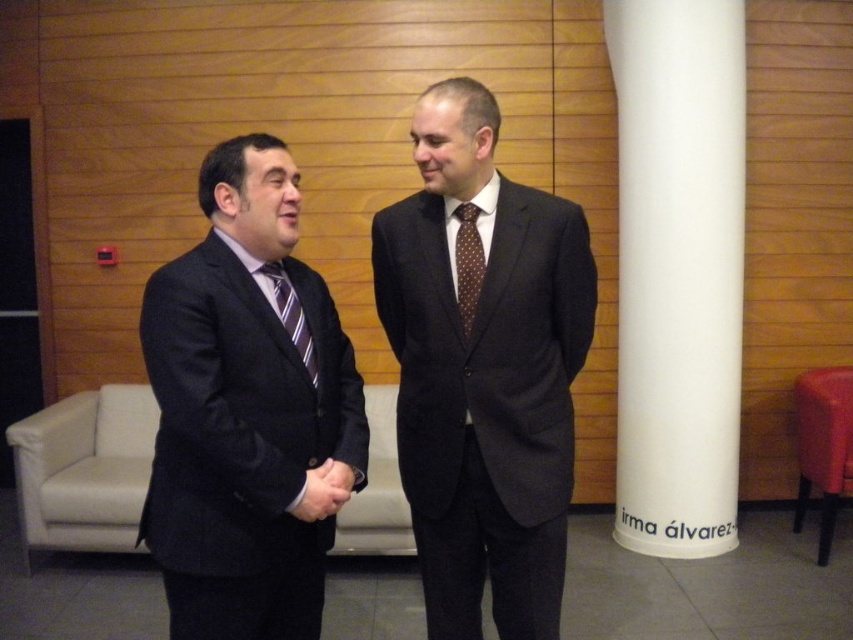
Does point (703, 90) lie in front of point (471, 216)?

That is False.

Is point (647, 388) positioned before point (466, 317)?

No, it is not.

The width and height of the screenshot is (853, 640). I want to click on white smooth pillar at right, so click(677, 269).

Does dark gray suit at center have a smaller size compared to matte black suit at center?

No.

Which is more to the right, dark gray suit at center or matte black suit at center?

From the viewer's perspective, dark gray suit at center appears more on the right side.

Find the location of `dark gray suit at center`. dark gray suit at center is located at coordinates (483, 371).

Does dark gray suit at center appear under white smooth pillar at right?

Yes, dark gray suit at center is below white smooth pillar at right.

Is dark gray suit at center behind white smooth pillar at right?

No, dark gray suit at center is in front of white smooth pillar at right.

This screenshot has width=853, height=640. Identify the location of dark gray suit at center. (483, 371).